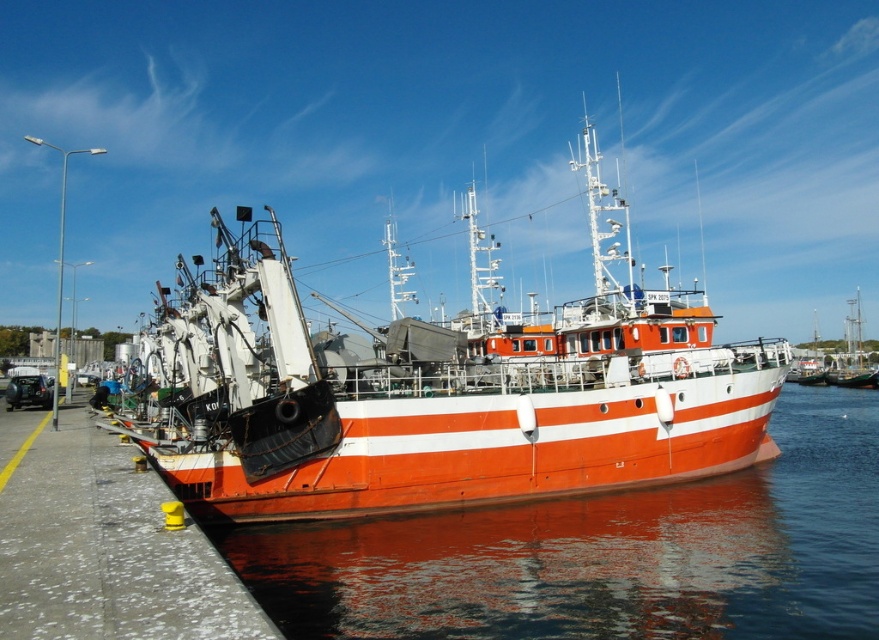
Who is positioned more to the left, orange matte boat at center or glossy water at lower right?

orange matte boat at center

Does orange matte boat at center appear on the right side of glossy water at lower right?

In fact, orange matte boat at center is to the left of glossy water at lower right.

The width and height of the screenshot is (879, 640). Identify the location of orange matte boat at center. (444, 388).